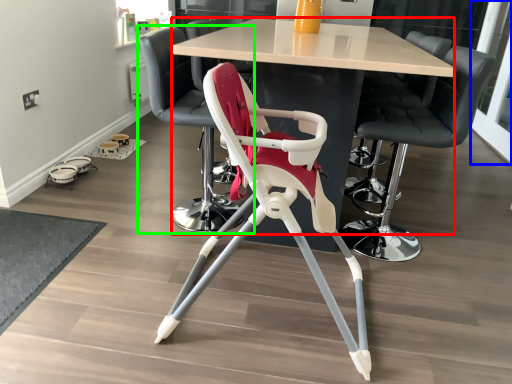
Question: Which object is the closest to the table (highlighted by a red box)? Choose among these: glass door (highlighted by a blue box) or chair (highlighted by a green box).

Choices:
 (A) glass door
 (B) chair

Answer: (B)